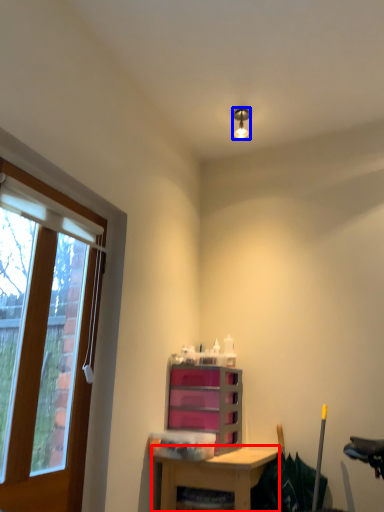
Question: Among these objects, which one is nearest to the camera, desk (highlighted by a red box) or light fixture (highlighted by a blue box)?

Choices:
 (A) desk
 (B) light fixture

Answer: (A)